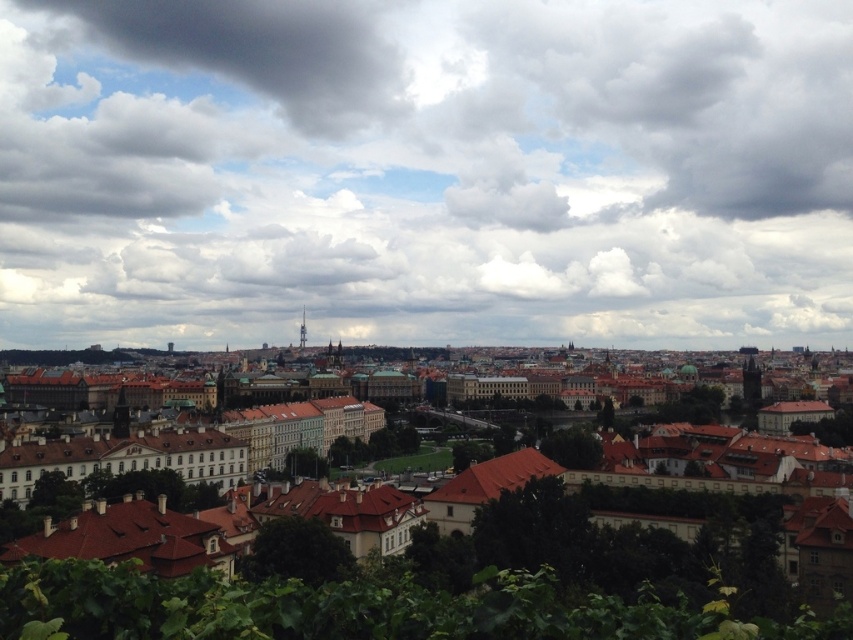
Question: Among these objects, which one is nearest to the camera?

Choices:
 (A) cloudy sky at center
 (B) brown stone buildings at center

Answer: (B)

Question: Among these points, which one is nearest to the camera?

Choices:
 (A) (277, 160)
 (B) (753, 595)

Answer: (B)

Question: Can you confirm if cloudy sky at center is bigger than brown stone buildings at center?

Choices:
 (A) no
 (B) yes

Answer: (B)

Question: Is cloudy sky at center in front of brown stone buildings at center?

Choices:
 (A) no
 (B) yes

Answer: (A)

Question: Can you confirm if cloudy sky at center is positioned below brown stone buildings at center?

Choices:
 (A) no
 (B) yes

Answer: (A)